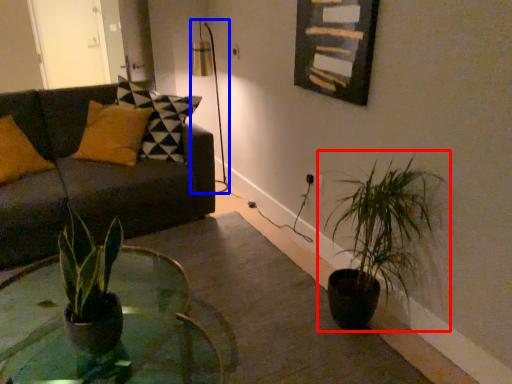
Question: Which point is closer to the camera, houseplant (highlighted by a red box) or table lamp (highlighted by a blue box)?

Choices:
 (A) houseplant
 (B) table lamp

Answer: (A)